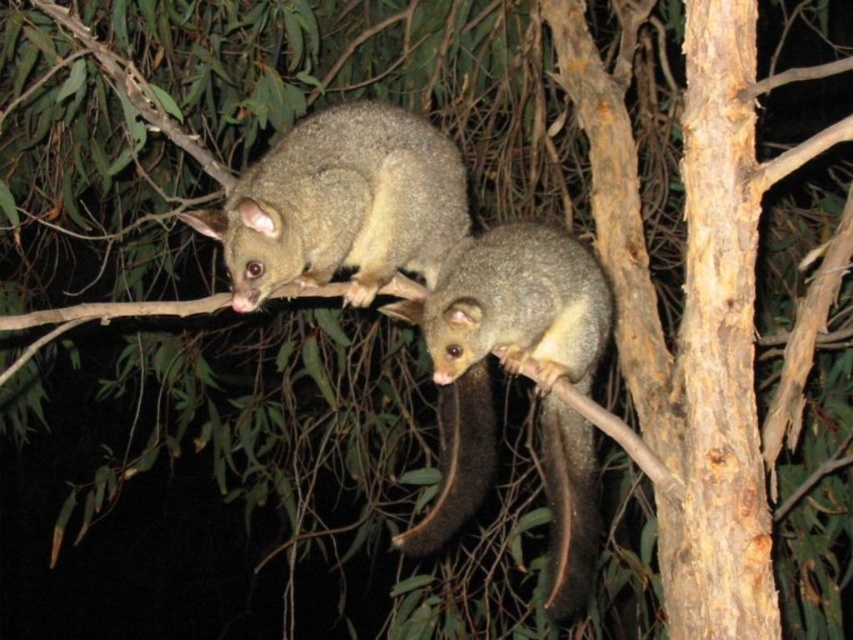
Question: Which object is closer to the camera taking this photo?

Choices:
 (A) brown furry tail at lower center
 (B) fuzzy gray possum at upper center

Answer: (B)

Question: Which of the following is the closest to the observer?

Choices:
 (A) (592, 508)
 (B) (270, 205)

Answer: (B)

Question: Is fuzzy gray possum at upper center below brown furry tail at lower center?

Choices:
 (A) yes
 (B) no

Answer: (B)

Question: Is fuzzy gray possum at upper center bigger than brown furry tail at lower center?

Choices:
 (A) yes
 (B) no

Answer: (A)

Question: Can you confirm if fuzzy gray possum at upper center is wider than brown furry tail at lower center?

Choices:
 (A) no
 (B) yes

Answer: (B)

Question: Which point is closer to the camera taking this photo?

Choices:
 (A) (315, 125)
 (B) (583, 561)

Answer: (B)